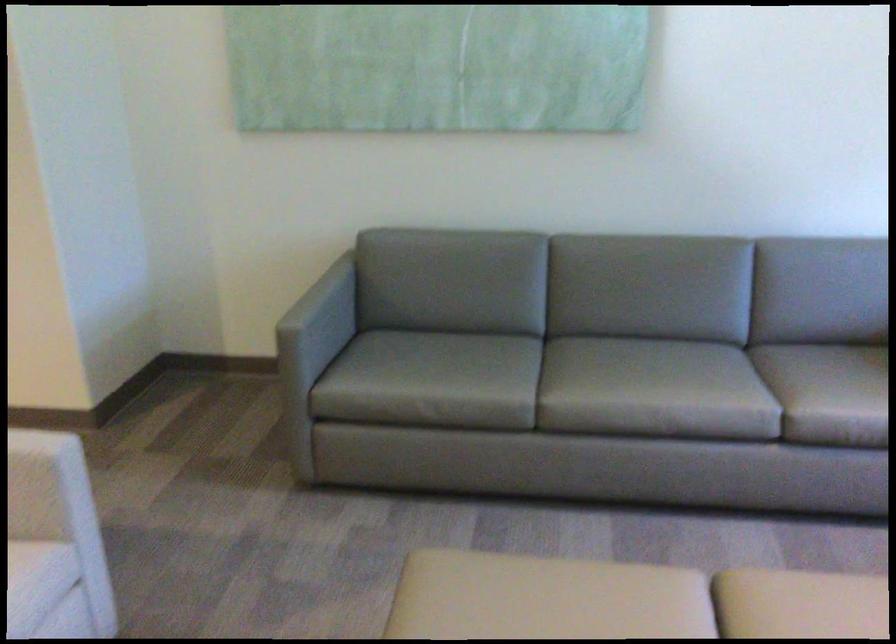
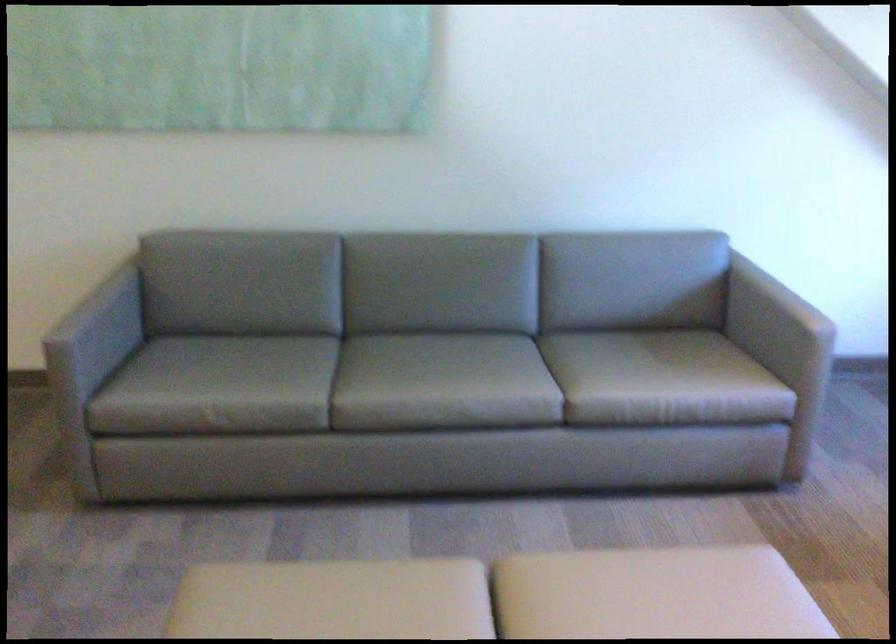
Question: Which direction would the cameraman need to move to produce the second image? Reply with the corresponding letter.

Choices:
 (A) Left
 (B) Right
 (C) Forward
 (D) Backward

Answer: (B)